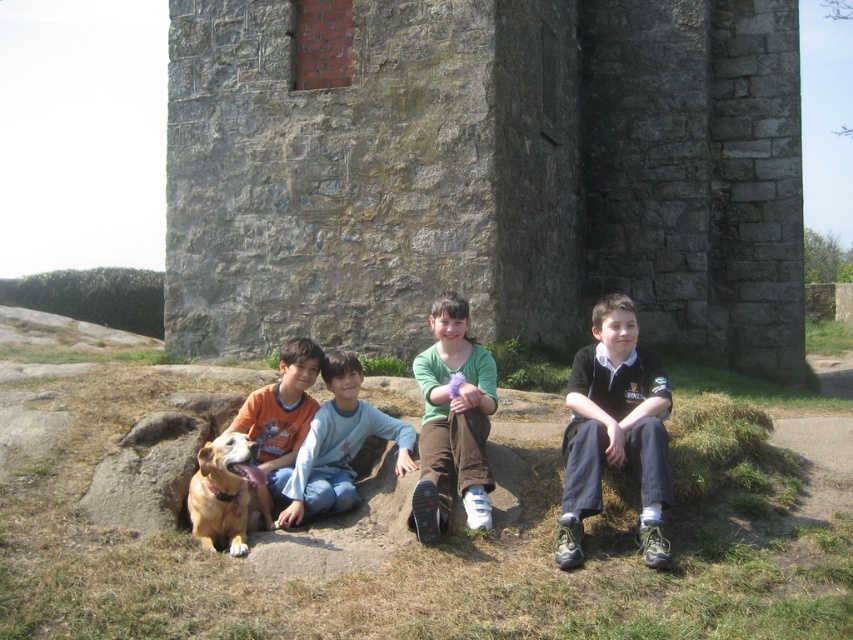
You are a photographer trying to capture a photo of the orange cotton shirt at center and the green matte shirt at center. Since the children are sitting on a large rock, which child should you focus on first to ensure both shirts are in the frame?

The orange cotton shirt at center should be focused on first because the green matte shirt at center is located below it, ensuring both are visible in the frame.

You are a painter who wants to paint the stone wall at center and the dark blue uniform at center. Which object should you focus on first if you want to paint the wider object?

The stone wall at center might be wider than dark blue uniform at center, so you should focus on painting the stone wall at center first.